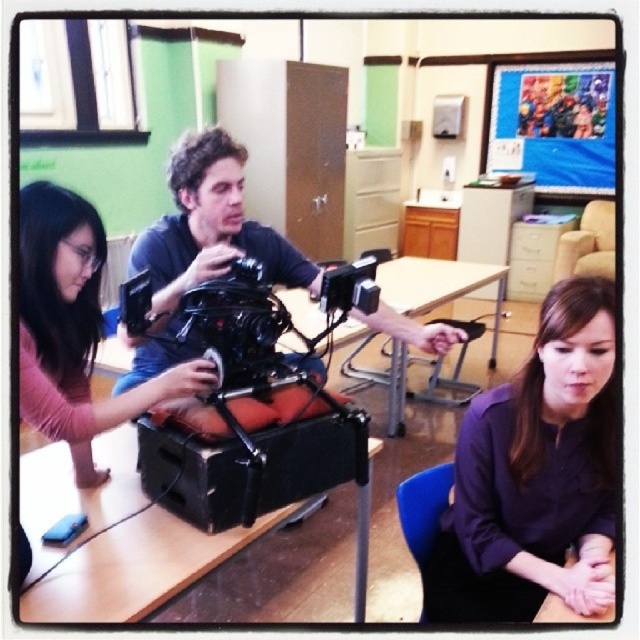
Locate an element on the screen. Image resolution: width=640 pixels, height=640 pixels. purple matte shirt at lower right is located at coordinates (536, 474).

Is purple matte shirt at lower right smaller than matte pink shirt at left?

Actually, purple matte shirt at lower right might be larger than matte pink shirt at left.

Where is `purple matte shirt at lower right`? purple matte shirt at lower right is located at coordinates (536, 474).

Which is below, black plastic table at center or wooden table at center?

Positioned lower is black plastic table at center.

The image size is (640, 640). I want to click on black plastic table at center, so click(113, 540).

You are a GUI agent. You are given a task and a screenshot of the screen. Output one action in this format:
    pyautogui.click(x=<x>, y=<y>)
    Task: Click on the black plastic table at center
    The width and height of the screenshot is (640, 640).
    Given the screenshot: What is the action you would take?
    pyautogui.click(x=113, y=540)

Looking at this image, is matte pink shirt at left bigger than wooden table at center?

No.

Can you confirm if matte pink shirt at left is thinner than wooden table at center?

Indeed, matte pink shirt at left has a lesser width compared to wooden table at center.

Find the location of a particular element. matte pink shirt at left is located at coordinates (74, 330).

I want to click on matte pink shirt at left, so click(x=74, y=330).